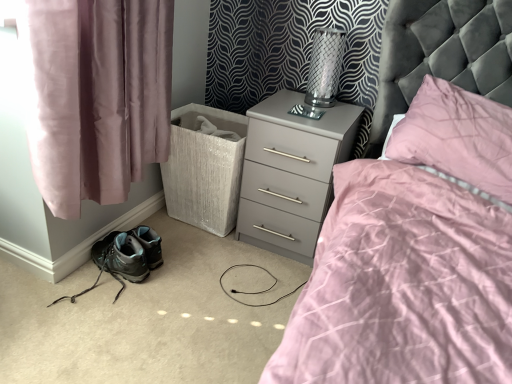
The image size is (512, 384). What are the coordinates of `vacant area that lies to the right of matte gray hiking boots at lower left` in the screenshot? It's located at (164, 301).